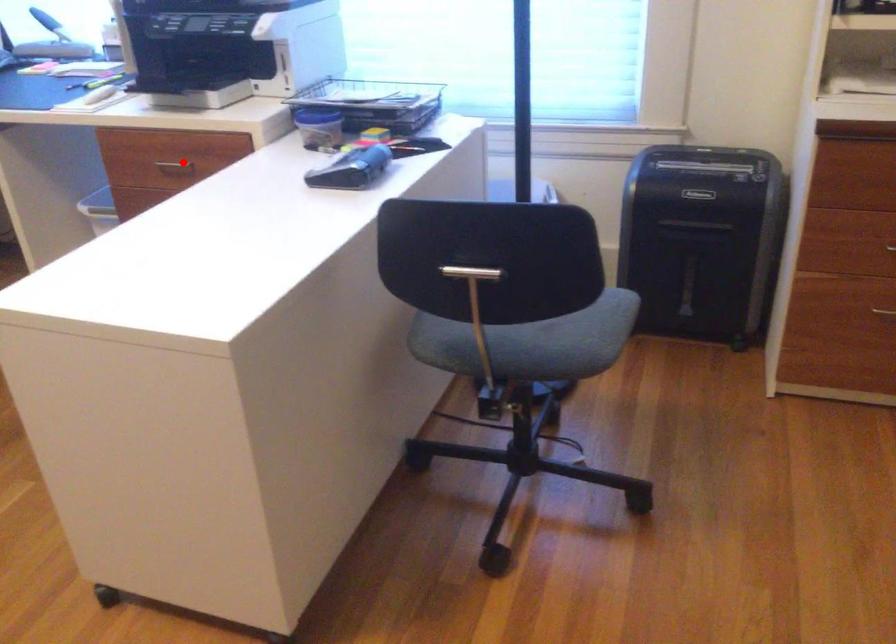
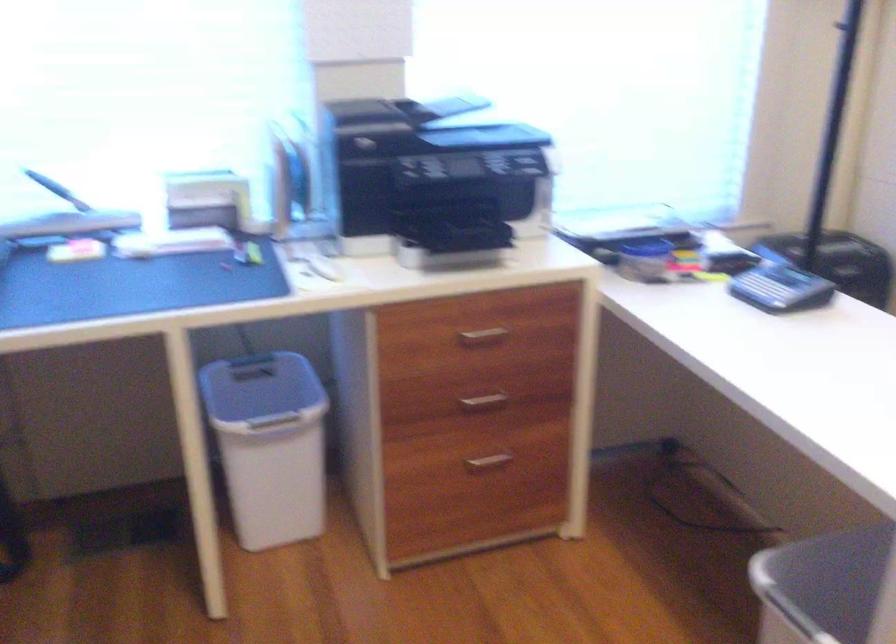
Question: A red point is marked in image1. In image2, is the corresponding 3D point closer to the camera or farther? Reply with the corresponding letter.

Choices:
 (A) The corresponding 3D point is closer.
 (B) The corresponding 3D point is farther.

Answer: (A)